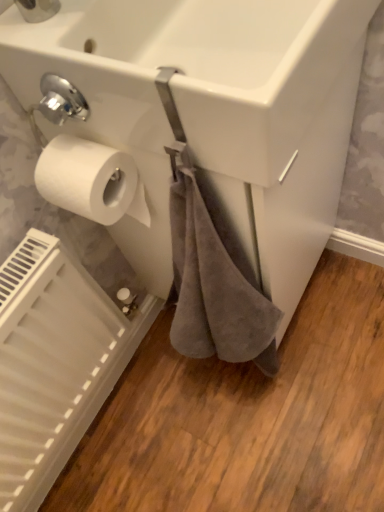
Question: Is point (64, 162) positioned closer to the camera than point (210, 155)?

Choices:
 (A) farther
 (B) closer

Answer: (A)

Question: Is white matte toilet paper at left in front of or behind white glossy sink at upper center in the image?

Choices:
 (A) behind
 (B) front

Answer: (A)

Question: Based on their relative distances, which object is farther from the white glossy sink at upper center?

Choices:
 (A) white matte toilet paper at left
 (B) white matte radiator at lower left

Answer: (B)

Question: Which object is positioned farthest from the white matte radiator at lower left?

Choices:
 (A) white matte toilet paper at left
 (B) white glossy sink at upper center

Answer: (B)